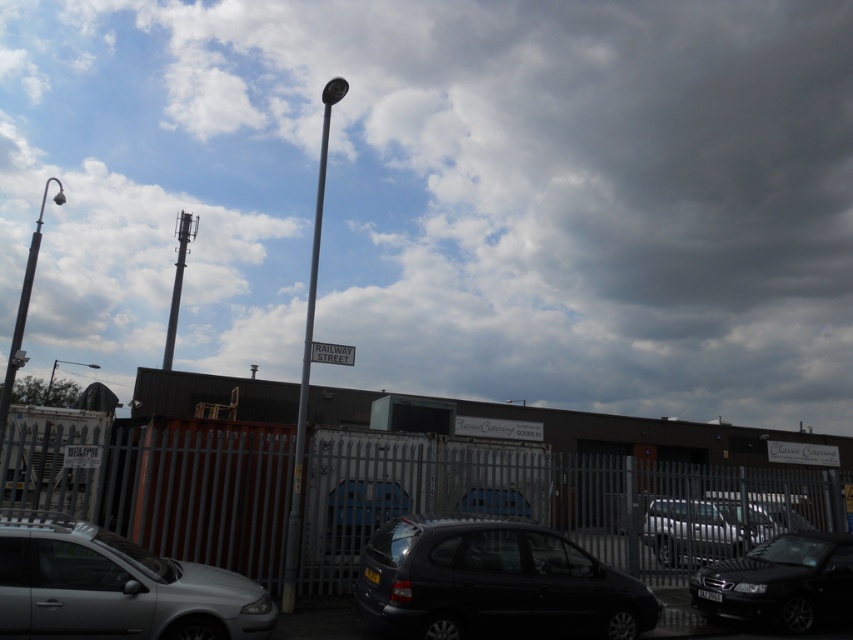
You are a delivery driver trying to navigate through the industrial area shown. You need to determine the shortest path between the two points marked as point (3, 593) and point (79, 362). Based on the scene description, which point is closer to the starting location of your vehicle?

Point (3, 593) is in front of point (79, 362), so the starting location of the vehicle is closer to point (3, 593).

You are a delivery driver approaching the industrial area and need to park your truck between the black metal streetlight at left and the metallic pole at upper center. Is there enough space between them to park your truck?

The black metal streetlight at left is positioned on the left side of metallic pole at upper center, but the distance between them is not provided in the description. Therefore, it is unclear if there is sufficient space to park the truck between them.

You are a delivery person with a cart that is 1.8 meters wide. You need to move from the metallic silver car at center to the metallic gray fence at center. Is there enough space between them for your cart to pass through?

The distance between the metallic gray fence at center and the metallic silver car at center is 2.45 meters. Since the cart is 1.8 meters wide, there is sufficient space for the cart to pass through as 2.45 meters is greater than 1.8 meters.